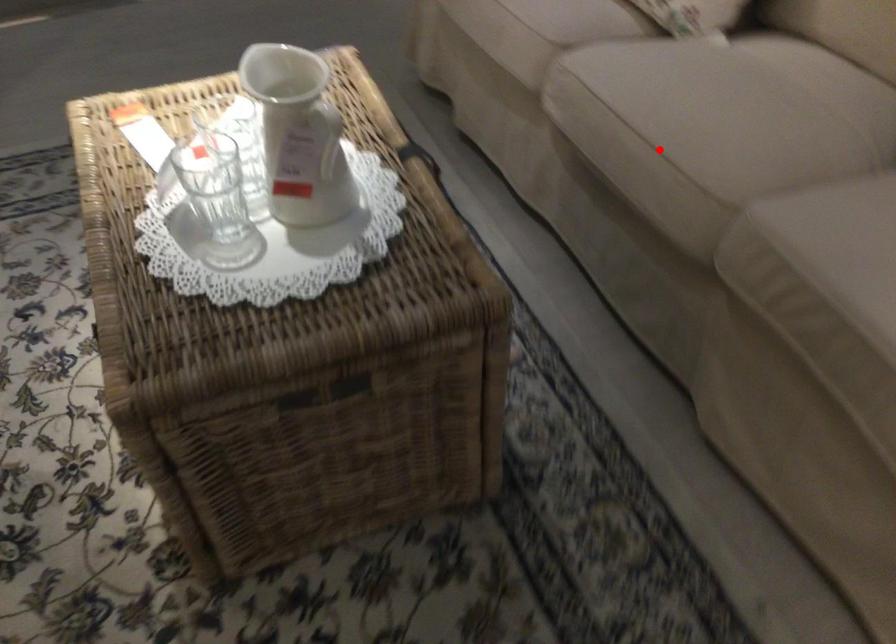
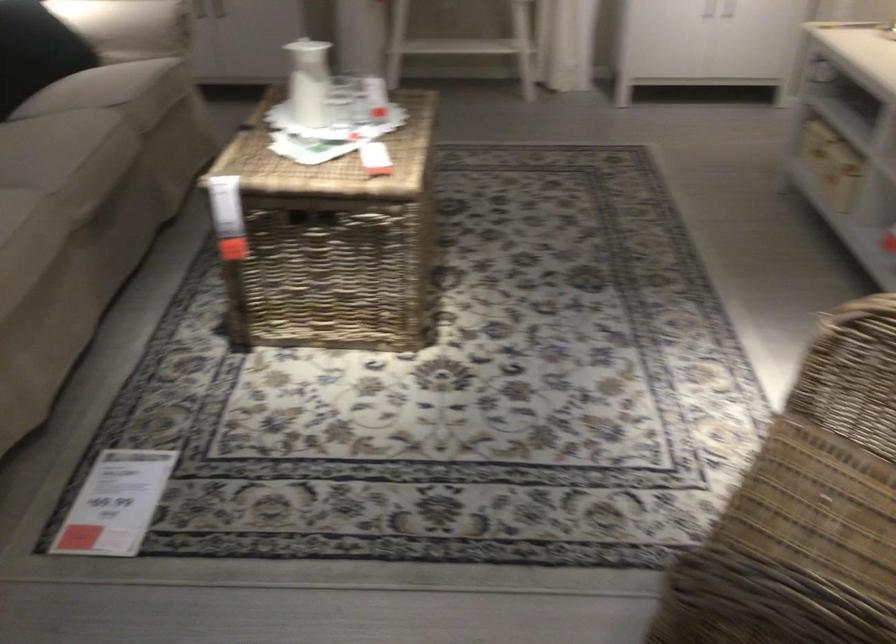
Where in the second image is the point corresponding to the highlighted location from the first image?

(109, 140)